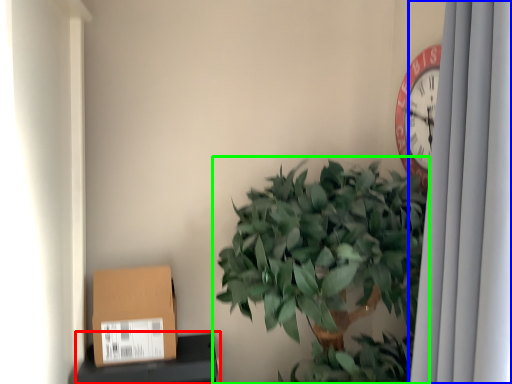
Question: Which object is the farthest from furniture (highlighted by a red box)? Choose among these: curtain (highlighted by a blue box) or houseplant (highlighted by a green box).

Choices:
 (A) curtain
 (B) houseplant

Answer: (A)